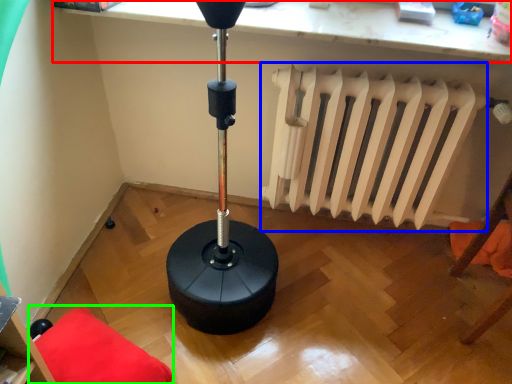
Question: Estimate the real-world distances between objects in this image. Which object is farther from computer (highlighted by a red box), radiator (highlighted by a blue box) or furniture (highlighted by a green box)?

Choices:
 (A) radiator
 (B) furniture

Answer: (B)